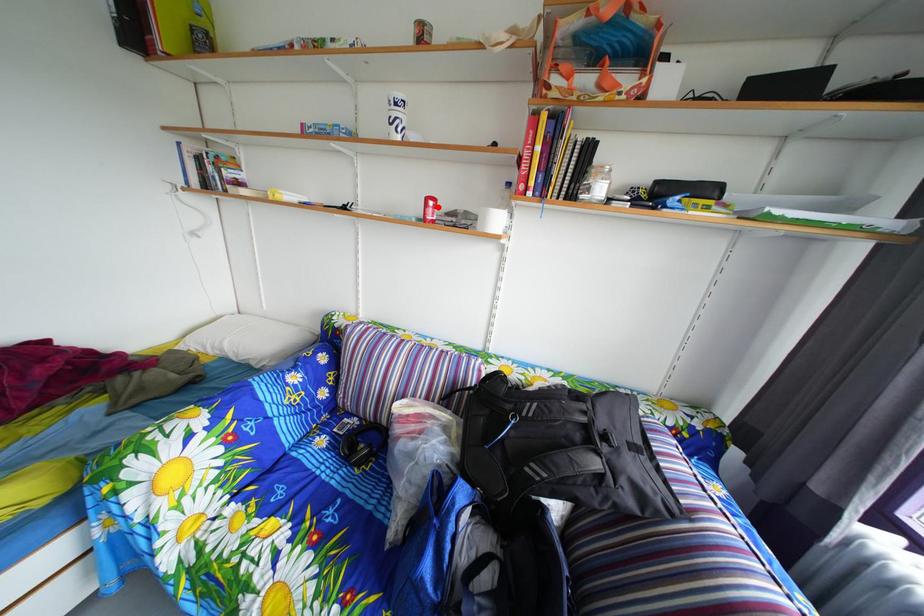
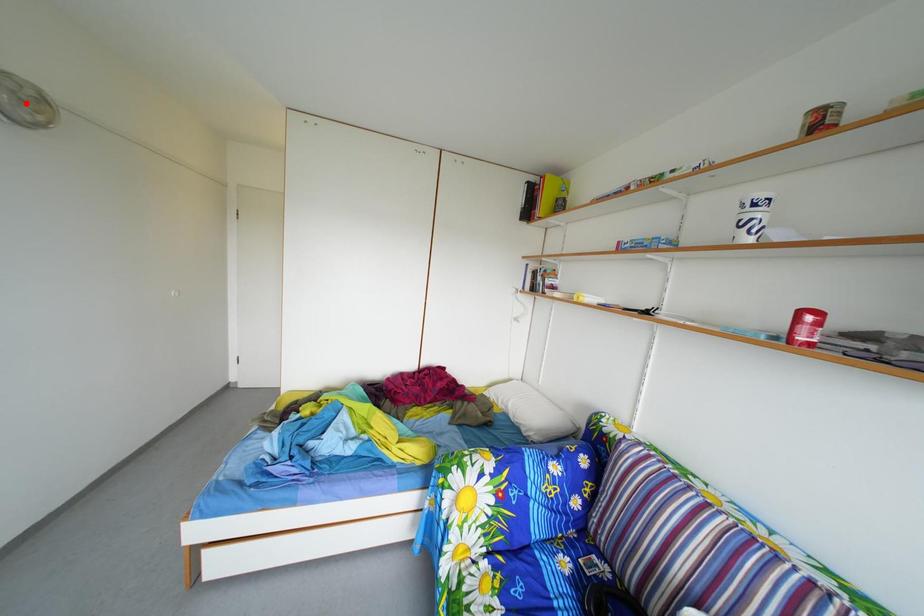
I am providing you with two images of the same scene from different viewpoints. A red point is marked on the first image and another point is marked on the second image. Is the red point in image1 aligned with the point shown in image2?

No